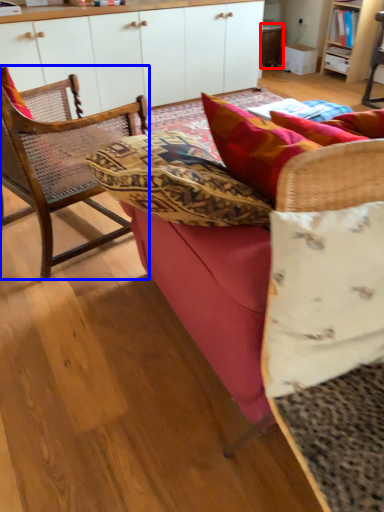
Question: Which object appears farthest to the camera in this image, table (highlighted by a red box) or chair (highlighted by a blue box)?

Choices:
 (A) table
 (B) chair

Answer: (A)